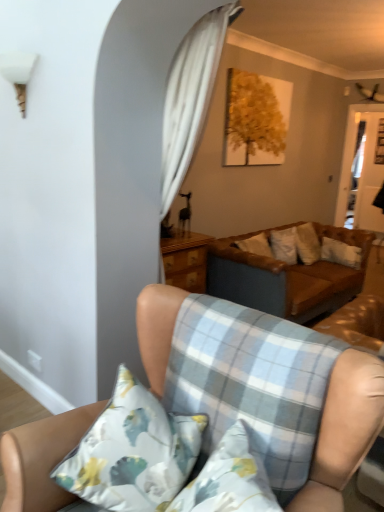
What do you see at coordinates (190, 97) in the screenshot? This screenshot has height=512, width=384. I see `white sheer curtain at upper center` at bounding box center [190, 97].

Image resolution: width=384 pixels, height=512 pixels. What do you see at coordinates (286, 277) in the screenshot?
I see `brown leather couch at center, which is the 2th studio couch in front-to-back order` at bounding box center [286, 277].

This screenshot has width=384, height=512. Find the location of `floral fabric pillow at lower left`. floral fabric pillow at lower left is located at coordinates (132, 452).

This screenshot has width=384, height=512. I want to click on light brown leather couch at center, the second studio couch viewed from the back, so click(x=344, y=430).

Where is `white sheer curtain at upper center`? The height and width of the screenshot is (512, 384). white sheer curtain at upper center is located at coordinates (190, 97).

From a real-world perspective, who is located lower, light brown leather couch at center, which is the 1th studio couch in front-to-back order, or brown leather couch at center, which is the 2th studio couch in front-to-back order?

In real-world perspective, brown leather couch at center, which is the 2th studio couch in front-to-back order, is lower.

Could you tell me if light brown leather couch at center, which is the 1th studio couch in front-to-back order, is facing brown leather couch at center, the first studio couch positioned from the back?

No, light brown leather couch at center, which is the 1th studio couch in front-to-back order, is not oriented towards brown leather couch at center, the first studio couch positioned from the back.

Considering the positions of points (139, 347) and (250, 268), is point (139, 347) closer to camera compared to point (250, 268)?

Yes.

Looking at this image, what's the angular difference between light brown leather couch at center, which is the 1th studio couch in front-to-back order, and brown leather couch at center, the first studio couch positioned from the back,'s facing directions?

The angular difference between light brown leather couch at center, which is the 1th studio couch in front-to-back order, and brown leather couch at center, the first studio couch positioned from the back, is 90.3 degrees.

Considering the sizes of objects white plastic lampshade at upper left and brown leather couch at center, which is the 2th studio couch in front-to-back order, in the image provided, who is thinner, white plastic lampshade at upper left or brown leather couch at center, which is the 2th studio couch in front-to-back order,?

With smaller width is white plastic lampshade at upper left.

From a real-world perspective, is white plastic lampshade at upper left located beneath brown leather couch at center, the first studio couch positioned from the back?

No.

From the image's perspective, between white plastic lampshade at upper left and brown leather couch at center, which is the 2th studio couch in front-to-back order, which one is located above?

From the image's view, white plastic lampshade at upper left is above.

Between white plastic lampshade at upper left and brown leather couch at center, the first studio couch positioned from the back, which one has smaller size?

white plastic lampshade at upper left.

This screenshot has height=512, width=384. What are the coordinates of `studio couch located below the brown leather couch at center, which is the 2th studio couch in front-to-back order (from the image's perspective)` in the screenshot? It's located at (344, 430).

Between brown leather couch at center, which is the 2th studio couch in front-to-back order, and light brown leather couch at center, which is the 1th studio couch in front-to-back order, which one has smaller width?

light brown leather couch at center, which is the 1th studio couch in front-to-back order.

Looking at this image, is brown leather couch at center, which is the 2th studio couch in front-to-back order, oriented away from light brown leather couch at center, which is the 1th studio couch in front-to-back order?

That's not correct — brown leather couch at center, which is the 2th studio couch in front-to-back order, is not looking away from light brown leather couch at center, which is the 1th studio couch in front-to-back order.

From a real-world perspective, is brown leather couch at center, the first studio couch positioned from the back, over light brown leather couch at center, the second studio couch viewed from the back?

Incorrect, from a real-world perspective, brown leather couch at center, the first studio couch positioned from the back, is lower than light brown leather couch at center, the second studio couch viewed from the back.

From a real-world perspective, which is physically below, transparent glass door at right or floral fabric pillow at lower left?

In real-world perspective, floral fabric pillow at lower left is lower.

Is transparent glass door at right smaller than floral fabric pillow at lower left?

Incorrect, transparent glass door at right is not smaller in size than floral fabric pillow at lower left.

From the image's perspective, is transparent glass door at right on top of floral fabric pillow at lower left?

Yes, from the image's perspective, transparent glass door at right is over floral fabric pillow at lower left.

Is transparent glass door at right not inside floral fabric pillow at lower left?

Absolutely, transparent glass door at right is external to floral fabric pillow at lower left.

From a real-world perspective, is light brown leather couch at center, which is the 1th studio couch in front-to-back order, above or below white plastic lampshade at upper left?

Clearly, from a real-world perspective, light brown leather couch at center, which is the 1th studio couch in front-to-back order, is below white plastic lampshade at upper left.

Measure the distance from light brown leather couch at center, the second studio couch viewed from the back, to white plastic lampshade at upper left.

light brown leather couch at center, the second studio couch viewed from the back, and white plastic lampshade at upper left are 1.92 meters apart.

What's the angular difference between light brown leather couch at center, which is the 1th studio couch in front-to-back order, and white plastic lampshade at upper left's facing directions?

light brown leather couch at center, which is the 1th studio couch in front-to-back order, and white plastic lampshade at upper left are facing 1.77 degrees away from each other.

Considering the sizes of objects light brown leather couch at center, which is the 1th studio couch in front-to-back order, and white plastic lampshade at upper left in the image provided, who is bigger, light brown leather couch at center, which is the 1th studio couch in front-to-back order, or white plastic lampshade at upper left?

Bigger between the two is light brown leather couch at center, which is the 1th studio couch in front-to-back order.

Is the surface of floral fabric pillow at lower left in direct contact with light brown leather couch at center, the second studio couch viewed from the back?

No, floral fabric pillow at lower left is not making contact with light brown leather couch at center, the second studio couch viewed from the back.

Can you confirm if floral fabric pillow at lower left is wider than light brown leather couch at center, the second studio couch viewed from the back?

No, floral fabric pillow at lower left is not wider than light brown leather couch at center, the second studio couch viewed from the back.

From a real-world perspective, between floral fabric pillow at lower left and light brown leather couch at center, which is the 1th studio couch in front-to-back order, who is vertically higher?

floral fabric pillow at lower left.

From a real-world perspective, does light blue plaid cushion at lower center stand above light brown leather couch at center, which is the 1th studio couch in front-to-back order?

Yes, from a real-world perspective, light blue plaid cushion at lower center is on top of light brown leather couch at center, which is the 1th studio couch in front-to-back order.

Which object is positioned more to the left, light blue plaid cushion at lower center or light brown leather couch at center, the second studio couch viewed from the back?

From the viewer's perspective, light brown leather couch at center, the second studio couch viewed from the back, appears more on the left side.

Between light blue plaid cushion at lower center and light brown leather couch at center, the second studio couch viewed from the back, which one has larger size?

Bigger between the two is light brown leather couch at center, the second studio couch viewed from the back.

Is point (283, 344) less distant than point (61, 424)?

Yes, it is.

Find the location of `studio couch below the light brown leather couch at center, which is the 1th studio couch in front-to-back order (from a real-world perspective)`. studio couch below the light brown leather couch at center, which is the 1th studio couch in front-to-back order (from a real-world perspective) is located at coordinates (286, 277).

Image resolution: width=384 pixels, height=512 pixels. What are the coordinates of `lamp in front of the brown leather couch at center, which is the 2th studio couch in front-to-back order` in the screenshot? It's located at (18, 73).

Looking at the image, which one is located further to transparent glass door at right, brown leather couch at center, the first studio couch positioned from the back, or light blue plaid cushion at lower center?

light blue plaid cushion at lower center.

Looking at the image, which one is located further to floral fabric pillow at lower left, transparent glass door at right or brown leather couch at center, which is the 2th studio couch in front-to-back order?

transparent glass door at right lies further to floral fabric pillow at lower left than the other object.

From the image, which object appears to be nearer to white plastic lampshade at upper left, transparent glass door at right or brown leather couch at center, which is the 2th studio couch in front-to-back order?

brown leather couch at center, which is the 2th studio couch in front-to-back order, lies closer to white plastic lampshade at upper left than the other object.

Considering their positions, is transparent glass door at right positioned closer to white plastic lampshade at upper left than light blue plaid cushion at lower center?

light blue plaid cushion at lower center.

Considering their positions, is floral fabric pillow at lower left positioned closer to light brown leather couch at center, which is the 1th studio couch in front-to-back order, than brown leather couch at center, which is the 2th studio couch in front-to-back order?

Among the two, floral fabric pillow at lower left is located nearer to light brown leather couch at center, which is the 1th studio couch in front-to-back order.

Estimate the real-world distances between objects in this image. Which object is further from brown leather couch at center, the first studio couch positioned from the back, transparent glass door at right or white plastic lampshade at upper left?

white plastic lampshade at upper left lies further to brown leather couch at center, the first studio couch positioned from the back, than the other object.

Looking at the image, which one is located closer to light brown leather couch at center, which is the 1th studio couch in front-to-back order, light blue plaid cushion at lower center or white plastic lampshade at upper left?

The object closer to light brown leather couch at center, which is the 1th studio couch in front-to-back order, is light blue plaid cushion at lower center.

Estimate the real-world distances between objects in this image. Which object is closer to floral fabric pillow at lower left, light brown leather couch at center, the second studio couch viewed from the back, or brown leather couch at center, the first studio couch positioned from the back?

light brown leather couch at center, the second studio couch viewed from the back, is closer to floral fabric pillow at lower left.

Find the location of a particular element. This screenshot has width=384, height=512. plaid between white sheer curtain at upper center and light brown leather couch at center, the second studio couch viewed from the back, from top to bottom is located at coordinates (252, 383).

Identify the location of lamp between floral fabric pillow at lower left and brown leather couch at center, the first studio couch positioned from the back, from front to back. The width and height of the screenshot is (384, 512). (18, 73).

You are a GUI agent. You are given a task and a screenshot of the screen. Output one action in this format:
    pyautogui.click(x=<x>, y=<y>)
    Task: Click on the lamp between light brown leather couch at center, which is the 1th studio couch in front-to-back order, and brown leather couch at center, the first studio couch positioned from the back, from front to back
    Image resolution: width=384 pixels, height=512 pixels.
    Given the screenshot: What is the action you would take?
    pyautogui.click(x=18, y=73)

Identify the location of lamp positioned between white sheer curtain at upper center and transparent glass door at right from near to far. The height and width of the screenshot is (512, 384). (18, 73).